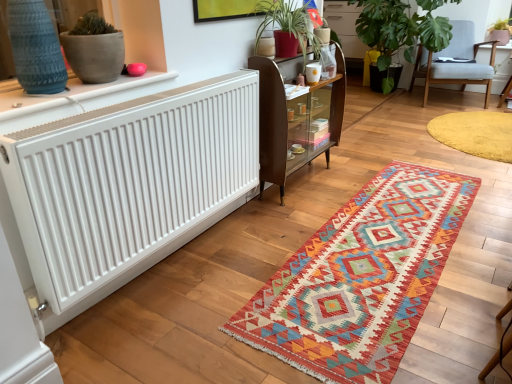
Image resolution: width=512 pixels, height=384 pixels. In order to click on free location to the right of wooden glass-fronted cabinet at center in this screenshot , I will do `click(350, 169)`.